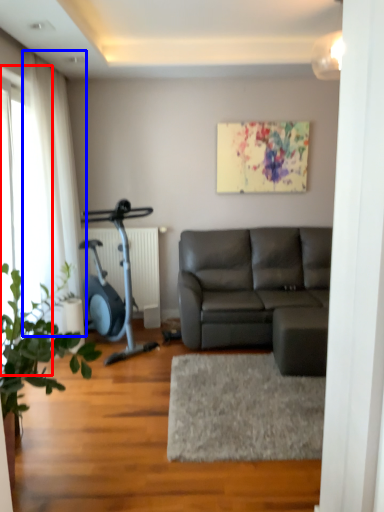
Question: Which object appears closest to the camera in this image, glass door (highlighted by a red box) or curtain (highlighted by a blue box)?

Choices:
 (A) glass door
 (B) curtain

Answer: (A)